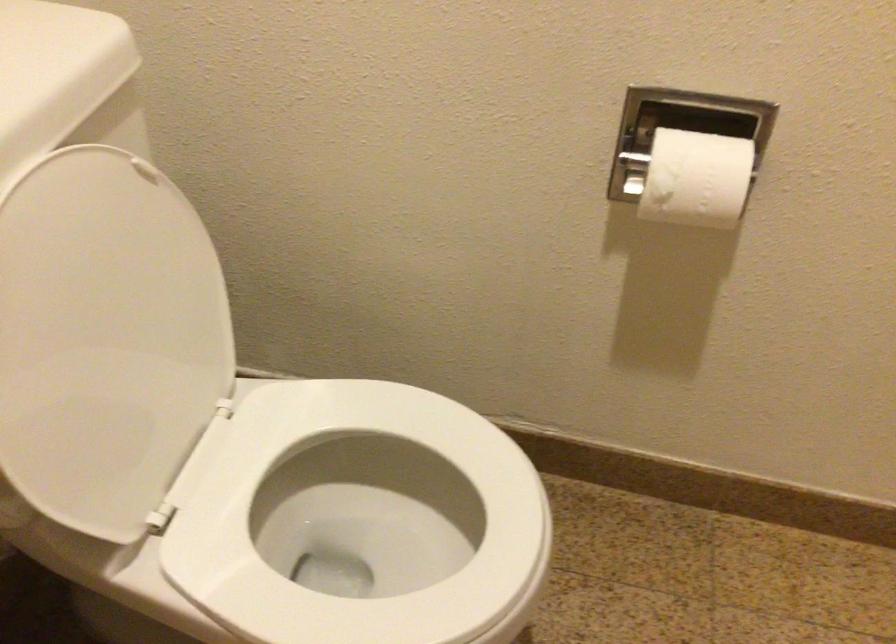
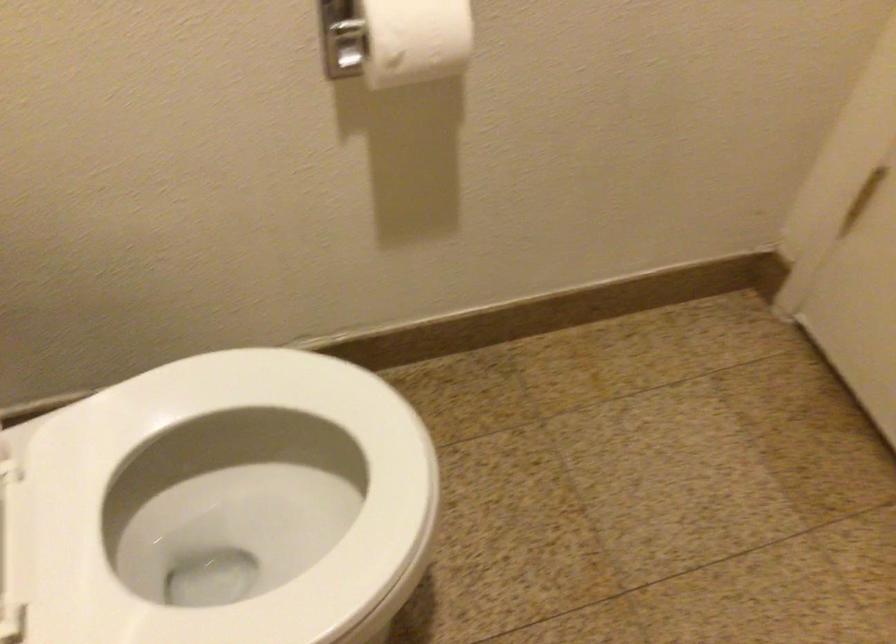
Question: The images are taken continuously from a first-person perspective. In which direction is your viewpoint rotating?

Choices:
 (A) Left
 (B) Right
 (C) Up
 (D) Down

Answer: (B)